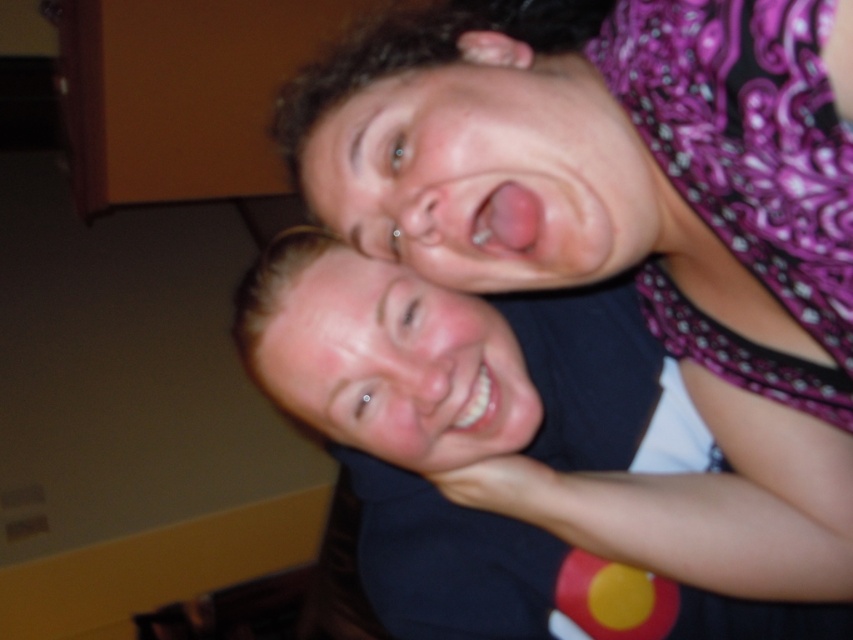
You are a photographer trying to focus on the smooth skin face at center. Since the matte black shirt at upper center is in the way, can you adjust your camera to focus on the face without moving the subjects?

The matte black shirt at upper center is closer to the viewer than the smooth skin face at center. To focus on the smooth skin face at center, you would need to adjust the camera focus to a longer focal length or move the camera position to avoid the obstruction caused by the matte black shirt at upper center being in front of the face.

You are a photographer trying to capture a candid shot of the two people in the scene. You want to ensure that both the matte black shirt at upper center and the matte skin face at upper center are clearly visible in the frame. Based on their positions, which object should you focus on first to ensure both are in focus?

The matte black shirt at upper center is to the right of the matte skin face at upper center. To ensure both are in focus, you should focus on the matte skin face at upper center first since it is closer to the camera, allowing the shirt to fall within the depth of field.

You are a photographer trying to capture a candid shot of the two people in the image. You need to ensure that both the matte black shirt at upper center and the matte skin face at upper center are in focus. Given that your camera can only focus on objects within a 5 inch range, can you capture both subjects clearly in one shot?

The matte black shirt at upper center and matte skin face at upper center are 8.03 inches apart from each other. Since the camera can only focus within a 5 inch range, the distance between them exceeds this limit, so it would not be possible to capture both clearly in focus in one shot.